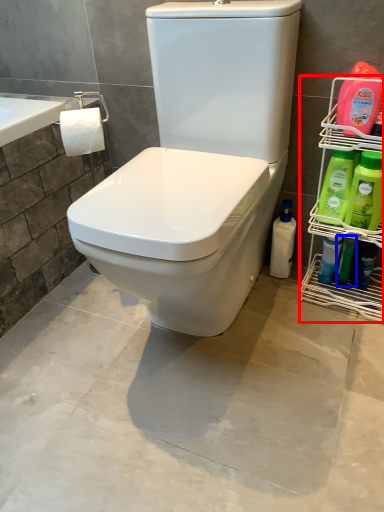
Question: Which of the following is the closest to the observer, shelf (highlighted by a red box) or cleaning product (highlighted by a blue box)?

Choices:
 (A) shelf
 (B) cleaning product

Answer: (A)